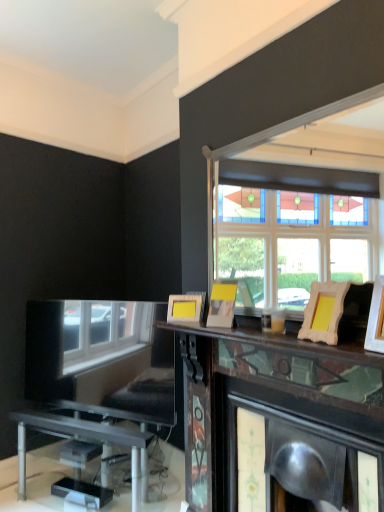
Question: Based on their sizes in the image, would you say wooden picture frame at right, arranged as the first picture frame when viewed from the front, is bigger or smaller than yellow matte picture frame at center, the first picture frame viewed from the back?

Choices:
 (A) small
 (B) big

Answer: (B)

Question: From the image's perspective, relative to yellow matte picture frame at center, the first picture frame viewed from the back, is wooden picture frame at right, which is the first picture frame from right to left, above or below?

Choices:
 (A) above
 (B) below

Answer: (A)

Question: Which is farther from the wooden picture frame at upper right, which is counted as the 3th picture frame, starting from the back?

Choices:
 (A) wooden picture frame at right, which is the first picture frame from right to left
 (B) yellow matte picture frame at center, acting as the 4th picture frame starting from the front
 (C) yellow matte picture frame at upper center, which appears as the second picture frame when viewed from the back

Answer: (B)

Question: Which of these objects is positioned farthest from the yellow matte picture frame at center, the 4th picture frame from the right?

Choices:
 (A) yellow matte picture frame at upper center, the third picture frame viewed from the front
 (B) wooden picture frame at right, which is the first picture frame from right to left
 (C) wooden picture frame at upper right, which ranks as the second picture frame in right-to-left order

Answer: (B)